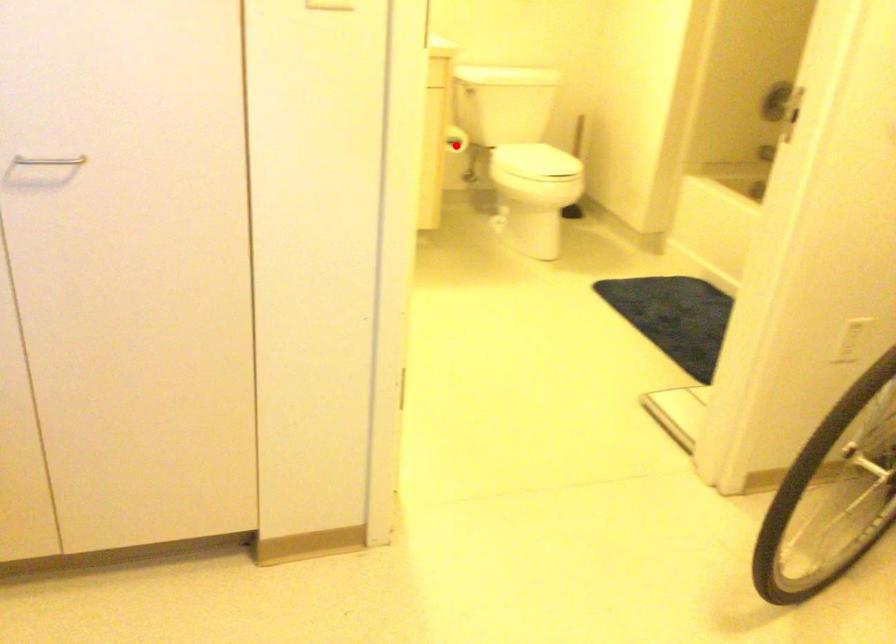
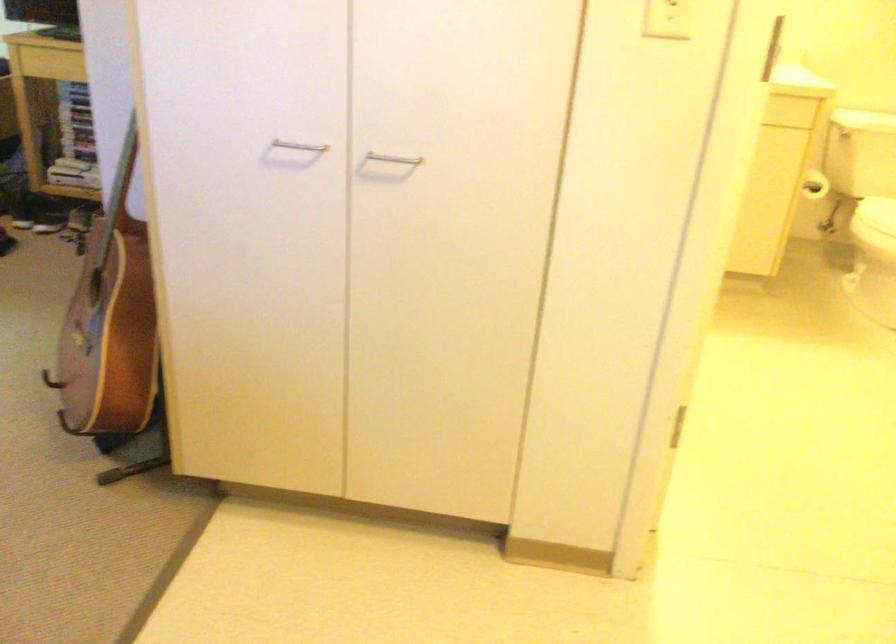
Find the pixel in the second image that matches the highlighted location in the first image.

(814, 185)